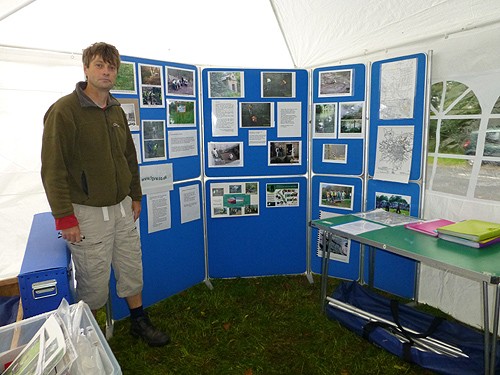
Find the location of a particular element. This screenshot has height=375, width=500. poster is located at coordinates (405, 87).